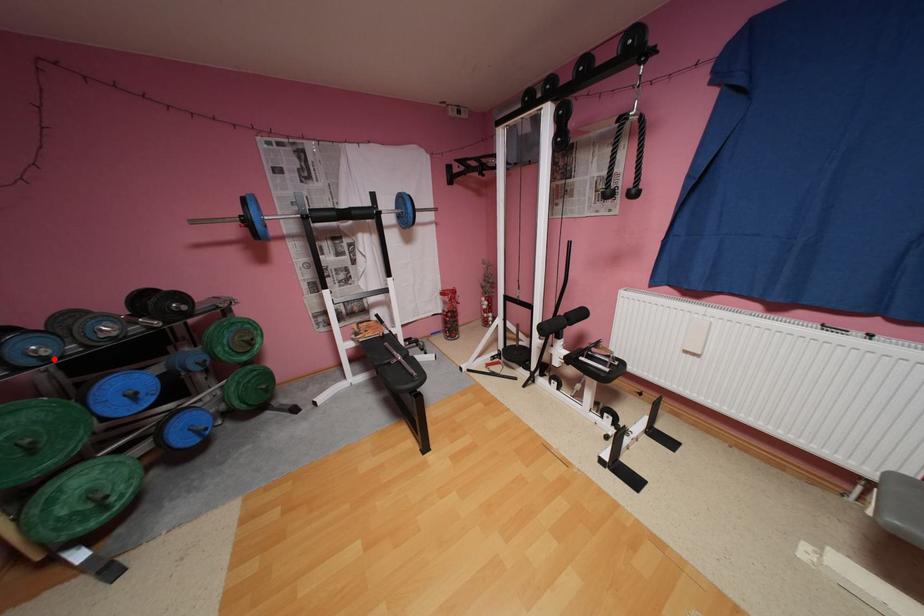
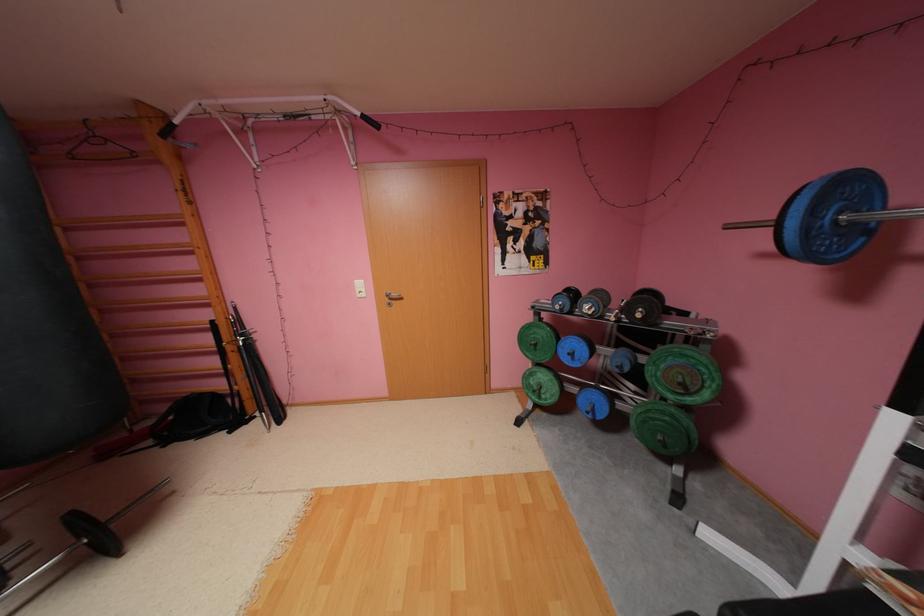
Where in the second image is the point corresponding to the highlighted location from the first image?

(570, 310)